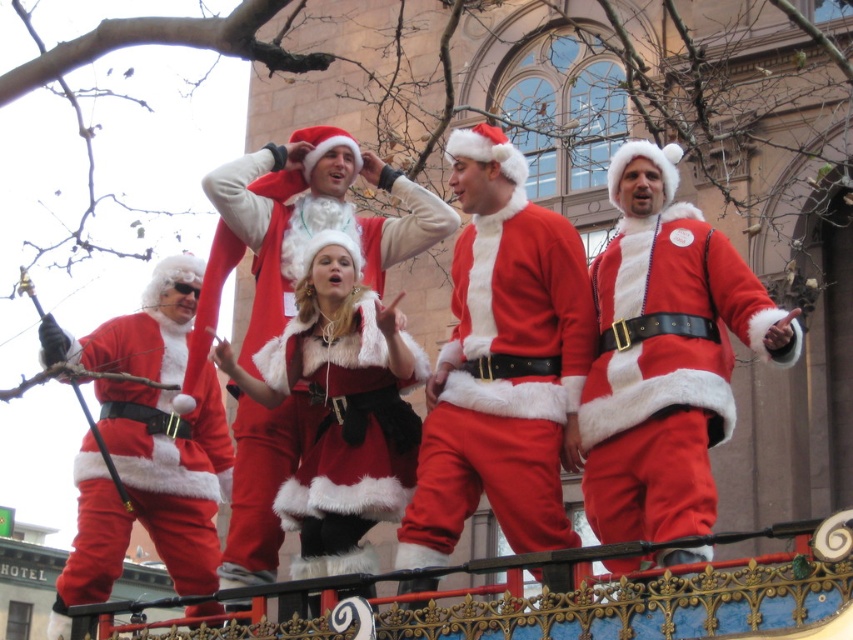
Question: Which is nearer to the fuzzy red santa at center?

Choices:
 (A) fuzzy red santa suit at center
 (B) matte red santa suit at left

Answer: (A)

Question: Which point is farther from the camera taking this photo?

Choices:
 (A) (271, 452)
 (B) (727, 342)

Answer: (A)

Question: Is matte red santa suit at center further to the viewer compared to fuzzy red santa suit at center?

Choices:
 (A) no
 (B) yes

Answer: (A)

Question: Which object is positioned farthest from the fuzzy red santa at center?

Choices:
 (A) matte red santa suit at center
 (B) matte red santa suit at left
 (C) fuzzy red santa suit at center

Answer: (B)

Question: Does fuzzy red santa at center have a smaller size compared to matte red santa suit at left?

Choices:
 (A) yes
 (B) no

Answer: (B)

Question: Is matte red santa suit at center smaller than fuzzy red santa suit at center?

Choices:
 (A) yes
 (B) no

Answer: (B)